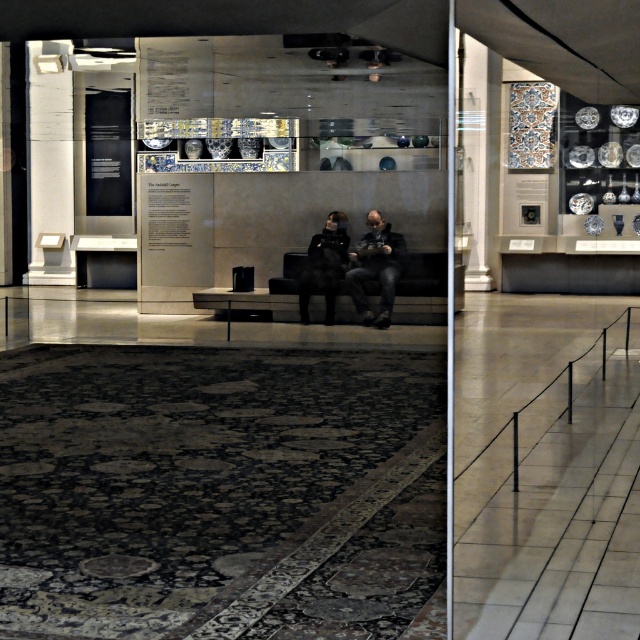
Which is behind, point (365, 240) or point (4, 109)?

The point (4, 109) is behind.

Does point (362, 237) come closer to viewer compared to point (0, 96)?

Yes, it is in front of point (0, 96).

Where is `dark gray fabric jacket at center`? The width and height of the screenshot is (640, 640). dark gray fabric jacket at center is located at coordinates (376, 268).

Can you confirm if dark gray fabric jacket at center is positioned to the left of black leather jacket at center?

In fact, dark gray fabric jacket at center is to the right of black leather jacket at center.

Consider the image. How far apart are dark gray fabric jacket at center and black leather jacket at center?

They are 25.25 inches apart.

Find the location of a particular element. dark gray fabric jacket at center is located at coordinates (376, 268).

At what (x,y) coordinates should I click in order to perform the action: click on dark gray fabric jacket at center. Please return your answer as a coordinate pair (x, y). This screenshot has height=640, width=640. Looking at the image, I should click on (376, 268).

Is white marble pillar at left to the left of wooden pillar at center from the viewer's perspective?

No, white marble pillar at left is not to the left of wooden pillar at center.

Between white marble pillar at left and wooden pillar at center, which one appears on the right side from the viewer's perspective?

Positioned to the right is white marble pillar at left.

Describe the element at coordinates (49, 163) in the screenshot. I see `white marble pillar at left` at that location.

Image resolution: width=640 pixels, height=640 pixels. I want to click on white marble pillar at left, so click(x=49, y=163).